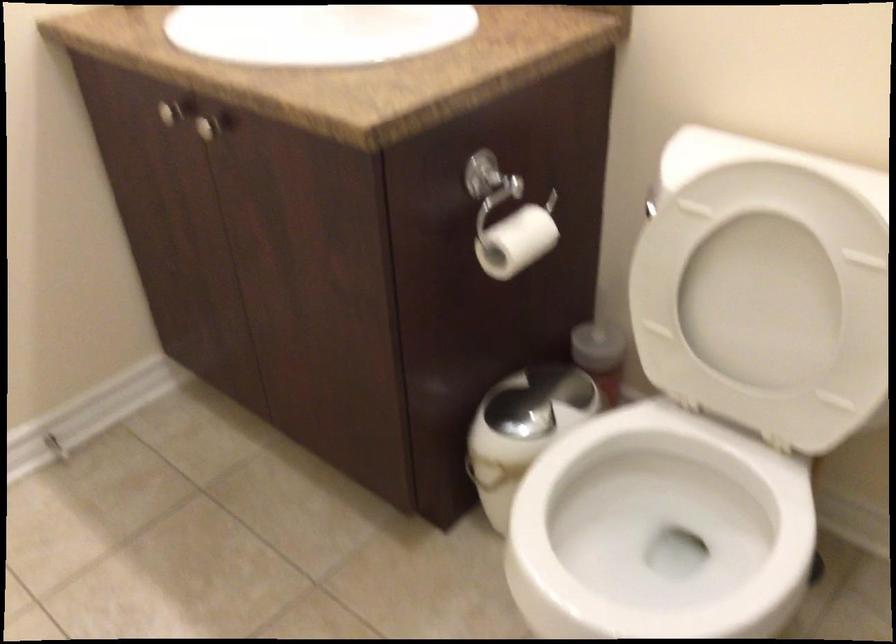
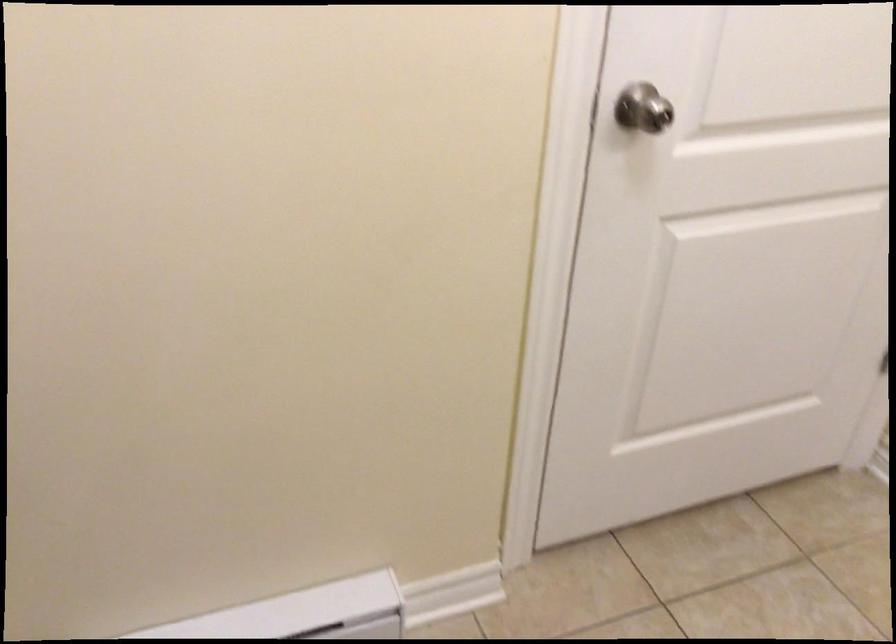
First-person continuous shooting, in which direction is the camera rotating?

The camera rotated toward left-down.